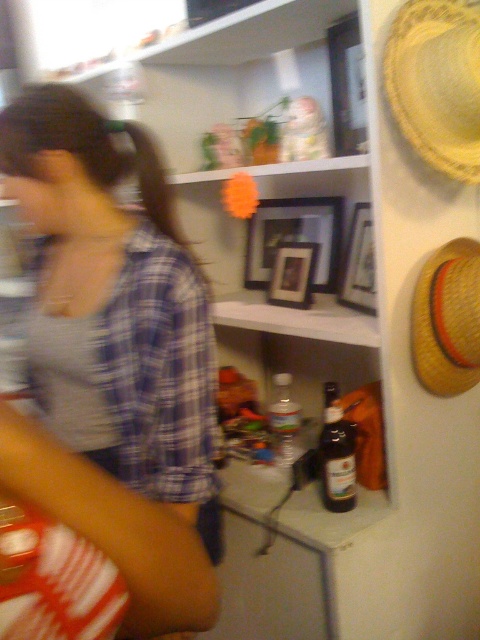
Question: Is blue plaid shirt at center above dark brown glass bottle at shelf center?

Choices:
 (A) yes
 (B) no

Answer: (A)

Question: Does blue plaid shirt at center appear on the left side of yellow straw hat at right?

Choices:
 (A) no
 (B) yes

Answer: (B)

Question: Which object is closer to the camera taking this photo?

Choices:
 (A) dark brown glass bottle at shelf center
 (B) blue plaid shirt at center
 (C) yellow straw hat at right

Answer: (B)

Question: Which is nearer to the dark brown glass bottle at shelf center?

Choices:
 (A) blue plaid shirt at center
 (B) yellow woven straw hat at upper right

Answer: (A)

Question: Among these points, which one is nearest to the camera?

Choices:
 (A) (458, 257)
 (B) (190, 449)
 (C) (445, 80)
 (D) (352, 445)

Answer: (B)

Question: In this image, where is yellow straw hat at right located relative to dark brown glass bottle at shelf center?

Choices:
 (A) left
 (B) right

Answer: (B)